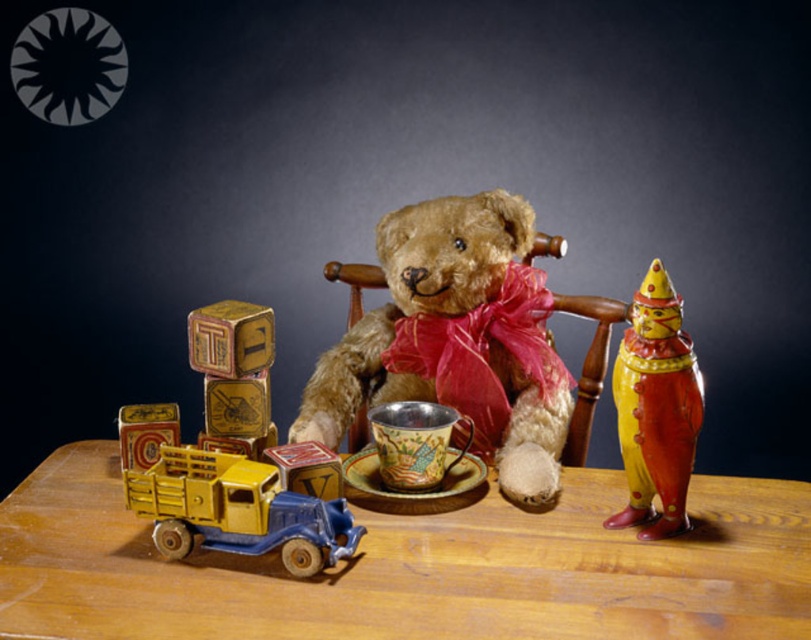
Question: Which point is farther from the camera taking this photo?

Choices:
 (A) (x=196, y=461)
 (B) (x=159, y=436)
 (C) (x=368, y=344)

Answer: (C)

Question: Is wooden table at center to the right of metallic yellow truck at lower left from the viewer's perspective?

Choices:
 (A) no
 (B) yes

Answer: (B)

Question: Which is nearer to the metallic blue truck at lower left?

Choices:
 (A) wooden blocks at center
 (B) soft brown teddy bear at center
 (C) wooden table at center
 (D) shiny yellow tin soldier at right

Answer: (C)

Question: Which point is closer to the camera taking this photo?

Choices:
 (A) (152, 410)
 (B) (462, 266)
 (C) (620, 424)
 (D) (267, 346)

Answer: (C)

Question: Is wooden table at center bigger than metallic blue truck at lower left?

Choices:
 (A) no
 (B) yes

Answer: (B)

Question: Can you confirm if soft brown teddy bear at center is smaller than shiny yellow tin soldier at right?

Choices:
 (A) no
 (B) yes

Answer: (A)